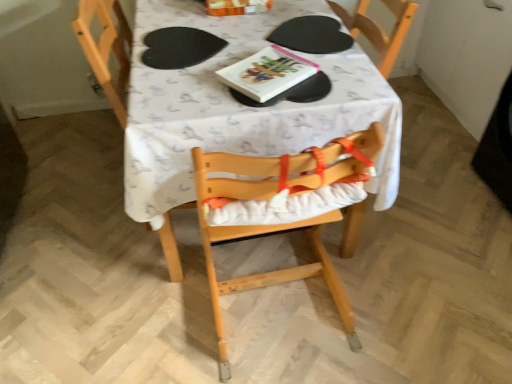
You are a GUI agent. You are given a task and a screenshot of the screen. Output one action in this format:
    pyautogui.click(x=<x>, y=<y>)
    Task: Click on the vacant space to the right of white fabric table at center
    This screenshot has width=512, height=384.
    Given the screenshot: What is the action you would take?
    pyautogui.click(x=437, y=200)